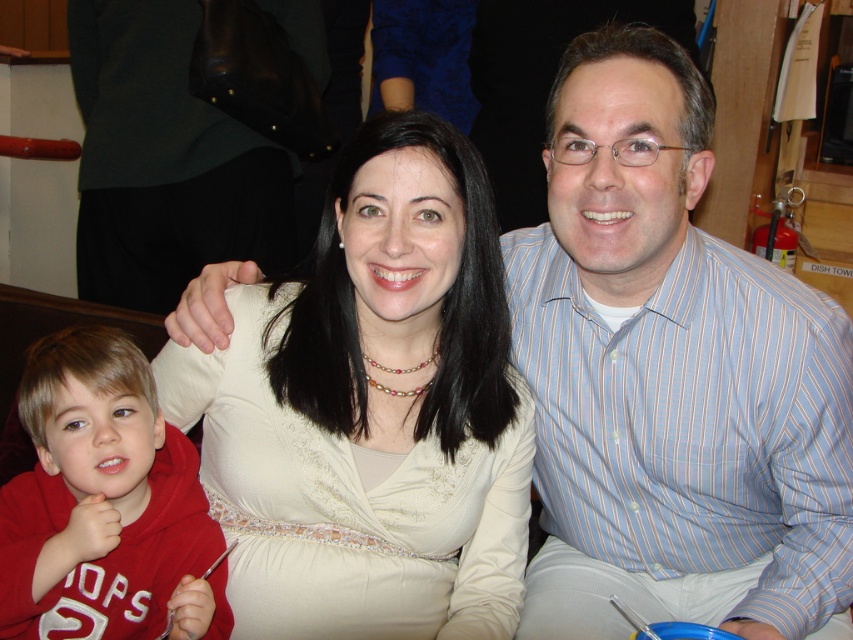
Measure the distance from matte white blouse at center to red fleece hoodie at lower left.

A distance of 7.51 inches exists between matte white blouse at center and red fleece hoodie at lower left.

From the picture: Between matte white blouse at center and red fleece hoodie at lower left, which one is positioned lower?

red fleece hoodie at lower left is lower down.

This screenshot has height=640, width=853. What do you see at coordinates (374, 410) in the screenshot?
I see `matte white blouse at center` at bounding box center [374, 410].

You are a GUI agent. You are given a task and a screenshot of the screen. Output one action in this format:
    pyautogui.click(x=<x>, y=<y>)
    Task: Click on the matte white blouse at center
    
    Given the screenshot: What is the action you would take?
    pyautogui.click(x=374, y=410)